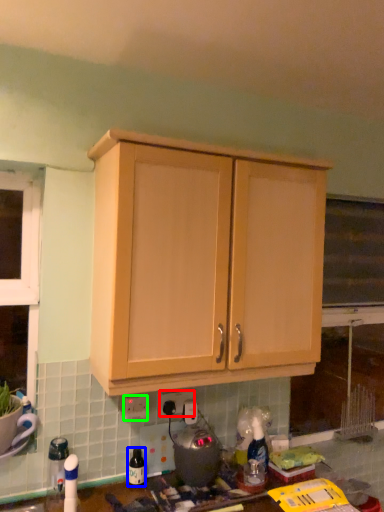
Question: Based on their relative distances, which object is nearer to electric outlet (highlighted by a red box)? Choose from bottle (highlighted by a blue box) and electric outlet (highlighted by a green box).

Choices:
 (A) bottle
 (B) electric outlet

Answer: (B)